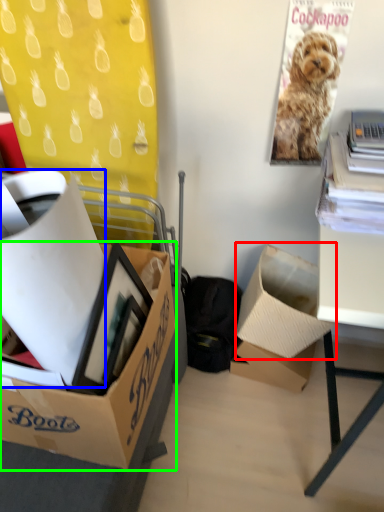
Question: Based on their relative distances, which object is nearer to box (highlighted by a red box)? Choose from box (highlighted by a blue box) and box (highlighted by a green box).

Choices:
 (A) box
 (B) box

Answer: (B)